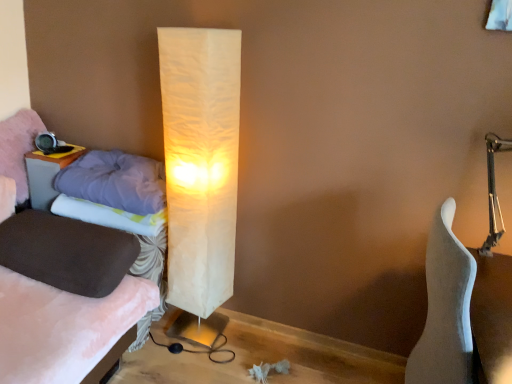
In order to click on vacant space in front of white paper lamp at center in this screenshot , I will do click(189, 365).